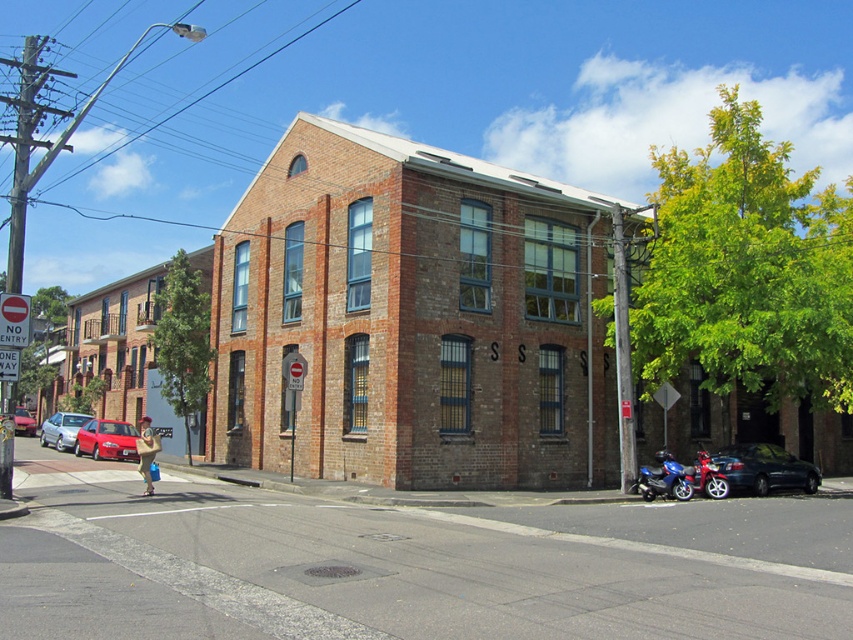
Does brick building at center appear on the left side of blue metallic motorcycle at lower right?

Correct, you'll find brick building at center to the left of blue metallic motorcycle at lower right.

Can you confirm if brick building at center is positioned to the right of blue metallic motorcycle at lower right?

In fact, brick building at center is to the left of blue metallic motorcycle at lower right.

Is point (782, 508) less distant than point (685, 467)?

Yes, it is in front of point (685, 467).

Locate an element on the screen. brick building at center is located at coordinates (408, 563).

Is shiny black sedan at lower right to the left of red matte car at left from the viewer's perspective?

No, shiny black sedan at lower right is not to the left of red matte car at left.

Is shiny black sedan at lower right in front of red matte car at left?

Yes, shiny black sedan at lower right is closer to the viewer.

I want to click on shiny black sedan at lower right, so click(x=764, y=468).

Is point (788, 497) behind point (64, 420)?

No, (788, 497) is closer to viewer.

Does brick building at center appear under red matte car at left?

Actually, brick building at center is above red matte car at left.

You are a GUI agent. You are given a task and a screenshot of the screen. Output one action in this format:
    pyautogui.click(x=<x>, y=<y>)
    Task: Click on the brick building at center
    This screenshot has width=853, height=640.
    Given the screenshot: What is the action you would take?
    pyautogui.click(x=408, y=563)